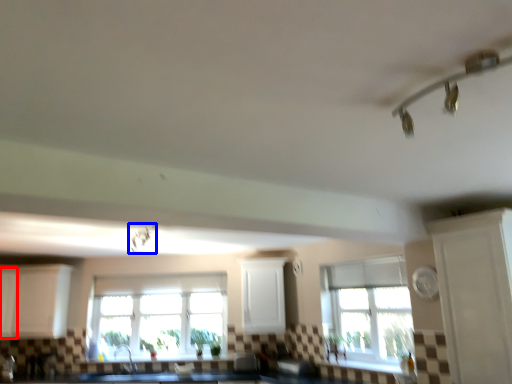
Question: Which point is further to the camera, cabinetry (highlighted by a red box) or light fixture (highlighted by a blue box)?

Choices:
 (A) cabinetry
 (B) light fixture

Answer: (A)